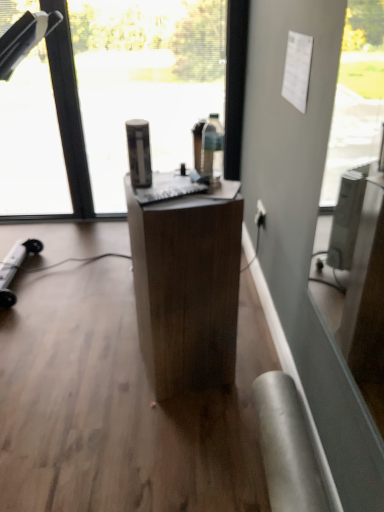
Identify the location of vacant region in front of transparent glass window at center. The height and width of the screenshot is (512, 384). (92, 387).